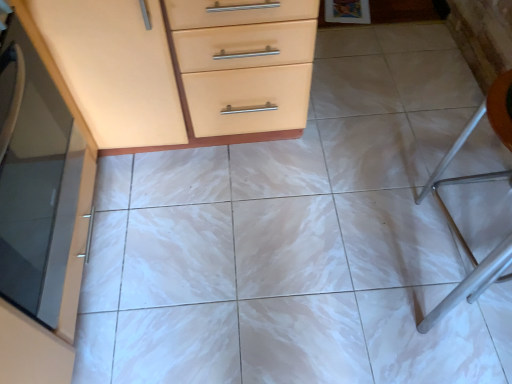
The image size is (512, 384). What are the coordinates of `vacant space to the right of matte wood chest of drawers at upper left, marked as the 1th chest of drawers in a bottom-to-top arrangement` in the screenshot? It's located at (395, 206).